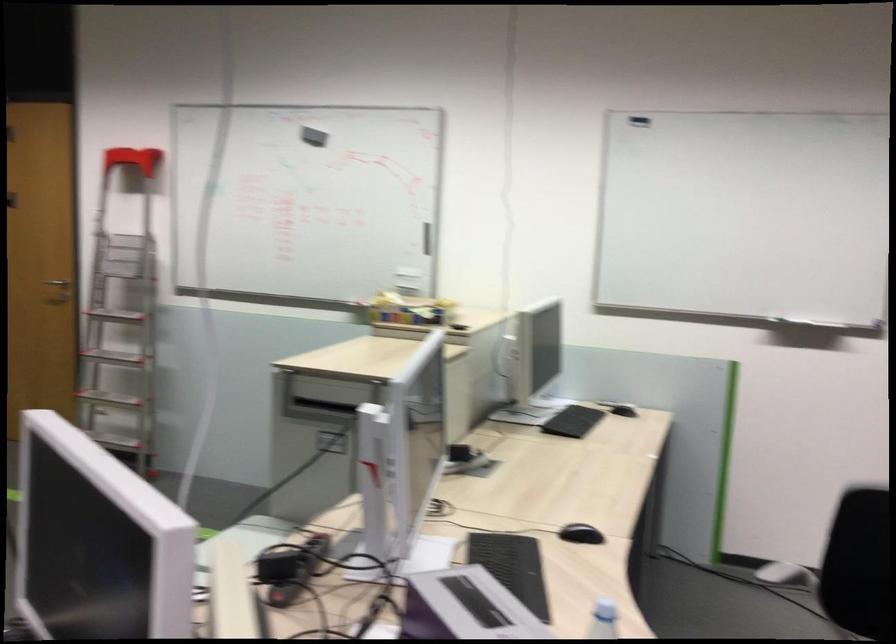
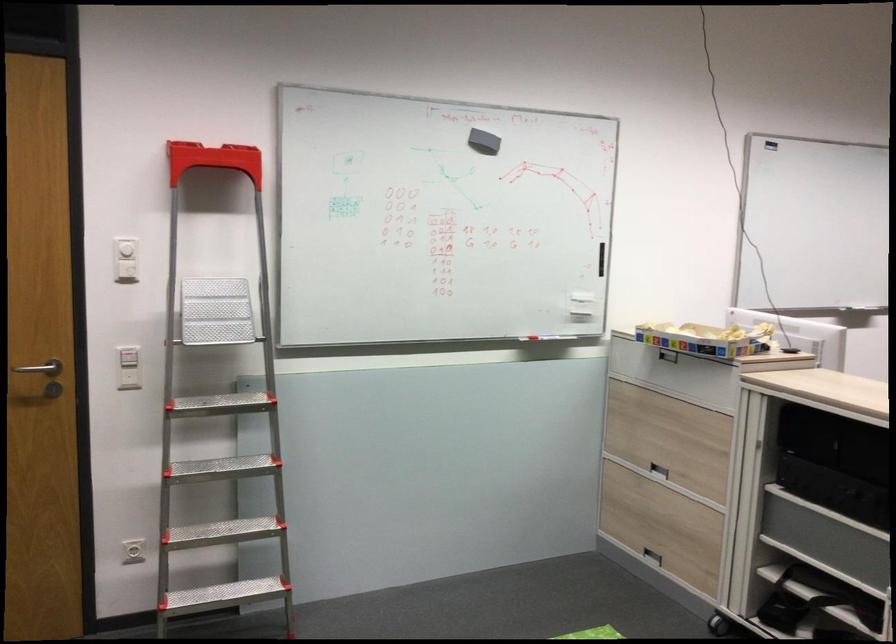
Question: I am providing you with two images of the same scene from different viewpoints. Please identify which objects are invisible in image2.

Choices:
 (A) silver door handle
 (B) whiteboard eraser
 (C) white wall dial
 (D) none of these

Answer: (D)